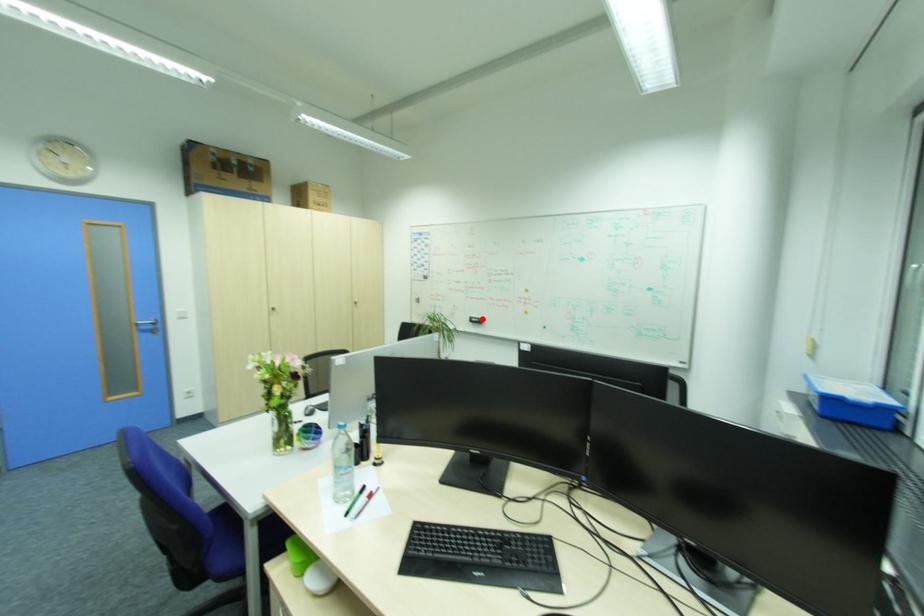
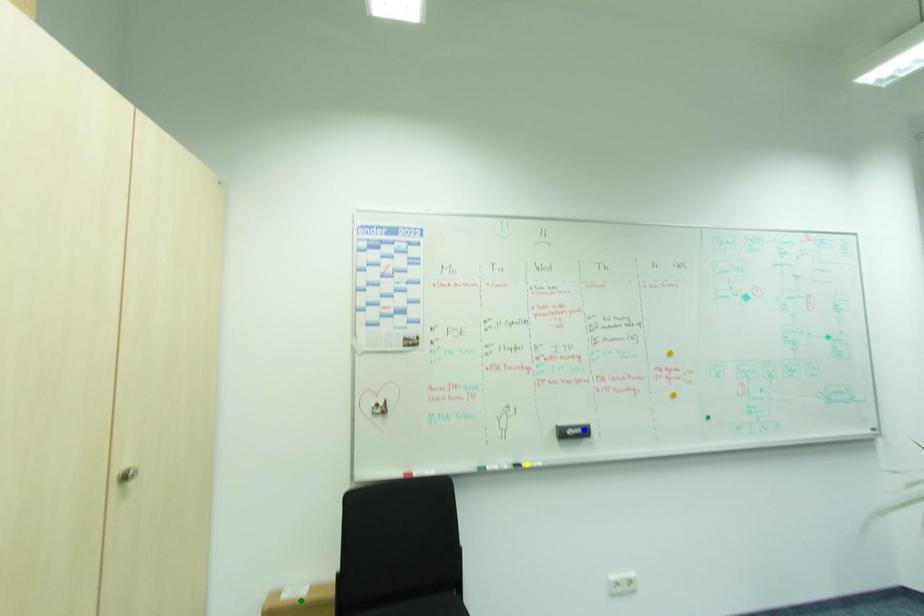
Question: I am providing you with two images of the same scene from different viewpoints. A red point is marked on the first image. You are given multiple points on the second image. In image 2, which mark is for the same physical point as the one in image 1?

Choices:
 (A) green point
 (B) blue point
 (C) yellow point

Answer: (B)